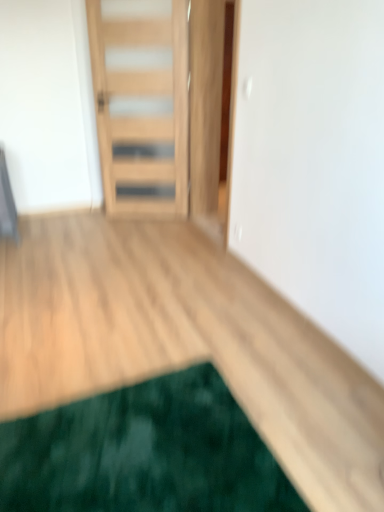
This screenshot has height=512, width=384. What are the coordinates of `green plush mat at lower left` in the screenshot? It's located at (143, 453).

What do you see at coordinates (143, 453) in the screenshot? I see `green plush mat at lower left` at bounding box center [143, 453].

In order to face green plush mat at lower left, should I rotate leftwards or rightwards?

Rotate left and turn 6.955 degrees.

This screenshot has height=512, width=384. Describe the element at coordinates (142, 115) in the screenshot. I see `natural wood door at center` at that location.

I want to click on natural wood door at center, so click(142, 115).

You are a GUI agent. You are given a task and a screenshot of the screen. Output one action in this format:
    pyautogui.click(x=<x>, y=<y>)
    Task: Click on the green plush mat at lower left
    The height and width of the screenshot is (512, 384).
    Given the screenshot: What is the action you would take?
    pyautogui.click(x=143, y=453)

Would you say natural wood door at center is to the left or to the right of green plush mat at lower left in the picture?

natural wood door at center is to the left of green plush mat at lower left.

Based on the photo, who is more distant, natural wood door at center or green plush mat at lower left?

natural wood door at center is further from the camera.

Considering the points (159, 80) and (112, 425), which point is in front, point (159, 80) or point (112, 425)?

The point (112, 425) is in front.

From the image's perspective, which object appears higher, natural wood door at center or green plush mat at lower left?

From the image's view, natural wood door at center is above.

From a real-world perspective, between natural wood door at center and green plush mat at lower left, who is vertically higher?

natural wood door at center.

In terms of width, does natural wood door at center look wider or thinner when compared to green plush mat at lower left?

Considering their sizes, natural wood door at center looks slimmer than green plush mat at lower left.

Consider the image. From their relative heights in the image, would you say natural wood door at center is taller or shorter than green plush mat at lower left?

natural wood door at center is taller than green plush mat at lower left.

Is natural wood door at center bigger or smaller than green plush mat at lower left?

natural wood door at center is bigger than green plush mat at lower left.

Is natural wood door at center spatially inside green plush mat at lower left, or outside of it?

natural wood door at center is not inside green plush mat at lower left, it's outside.

Are natural wood door at center and green plush mat at lower left making contact?

There is a gap between natural wood door at center and green plush mat at lower left.

Is natural wood door at center oriented away from green plush mat at lower left?

natural wood door at center does not have its back to green plush mat at lower left.

Locate an element on the screen. The image size is (384, 512). door that is above the green plush mat at lower left (from the image's perspective) is located at coordinates (142, 115).

Is green plush mat at lower left at the right side of natural wood door at center?

Correct, you'll find green plush mat at lower left to the right of natural wood door at center.

In the scene shown: Is green plush mat at lower left behind natural wood door at center?

No, green plush mat at lower left is closer to the camera.

Is point (59, 438) farther from viewer compared to point (174, 128)?

No, (59, 438) is closer to viewer.

From the image's perspective, between green plush mat at lower left and natural wood door at center, which one is located above?

natural wood door at center.

Based on the photo, from a real-world perspective, which object stands above the other?

natural wood door at center is physically above.

Is green plush mat at lower left wider than natural wood door at center?

Yes, green plush mat at lower left is wider than natural wood door at center.

Which of these two, green plush mat at lower left or natural wood door at center, stands shorter?

green plush mat at lower left is shorter.

Between green plush mat at lower left and natural wood door at center, which one has smaller size?

green plush mat at lower left is smaller.

Is green plush mat at lower left spatially inside natural wood door at center, or outside of it?

green plush mat at lower left is located beyond the bounds of natural wood door at center.

Is the surface of green plush mat at lower left in direct contact with natural wood door at center?

green plush mat at lower left is not next to natural wood door at center, and they're not touching.

Could you tell me if green plush mat at lower left is facing natural wood door at center?

No, green plush mat at lower left does not turn towards natural wood door at center.

The height and width of the screenshot is (512, 384). Identify the location of door lying above the green plush mat at lower left (from the image's perspective). (142, 115).

Where is `door above the green plush mat at lower left (from a real-world perspective)`? door above the green plush mat at lower left (from a real-world perspective) is located at coordinates (142, 115).

Identify the location of door on the left side of green plush mat at lower left. The image size is (384, 512). (142, 115).